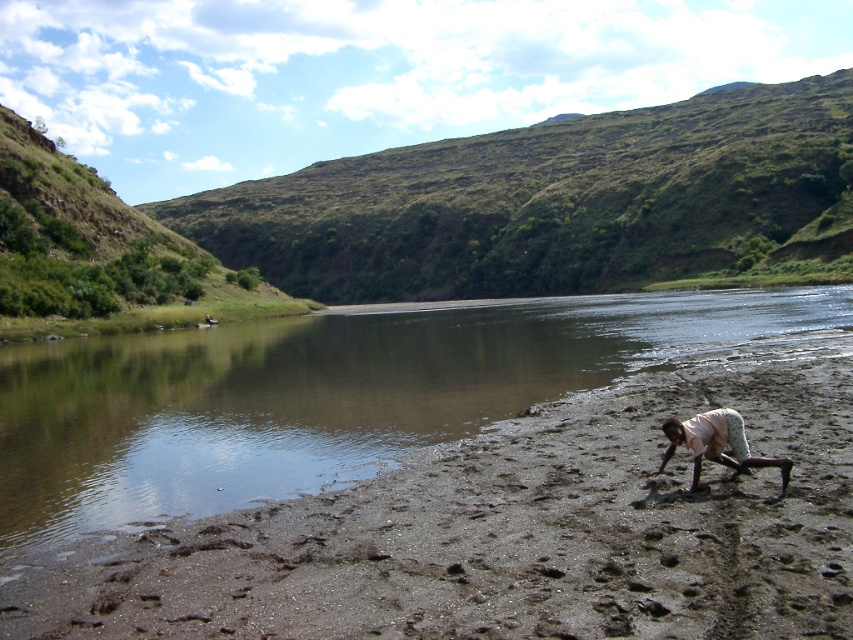
Question: Can you confirm if brown sandy beach at lower right is positioned above light beige fabric squat at lower right?

Choices:
 (A) no
 (B) yes

Answer: (A)

Question: Is brown sandy beach at lower right closer to the viewer compared to light beige fabric squat at lower right?

Choices:
 (A) yes
 (B) no

Answer: (A)

Question: Which object is closer to the camera taking this photo?

Choices:
 (A) brown sandy beach at lower right
 (B) light beige fabric squat at lower right

Answer: (A)

Question: Does brown sandy beach at lower right appear over light beige fabric squat at lower right?

Choices:
 (A) yes
 (B) no

Answer: (B)

Question: Which object appears farthest from the camera in this image?

Choices:
 (A) brown sandy beach at lower right
 (B) light beige fabric squat at lower right

Answer: (B)